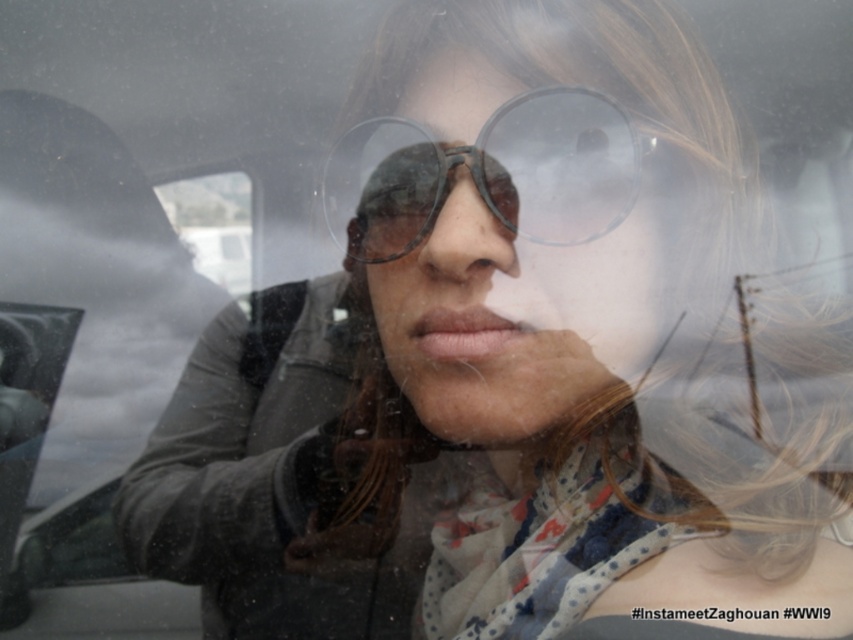
Question: Is transparent plastic goggles at center below matte plastic nose at center?

Choices:
 (A) no
 (B) yes

Answer: (A)

Question: Is transparent plastic goggles at center positioned at the back of matte plastic nose at center?

Choices:
 (A) no
 (B) yes

Answer: (B)

Question: Among these objects, which one is farthest from the camera?

Choices:
 (A) matte plastic nose at center
 (B) transparent plastic goggles at center

Answer: (B)

Question: Does transparent plastic goggles at center have a smaller size compared to matte plastic nose at center?

Choices:
 (A) yes
 (B) no

Answer: (B)

Question: Which of the following is the farthest from the observer?

Choices:
 (A) transparent plastic goggles at center
 (B) matte plastic nose at center

Answer: (A)